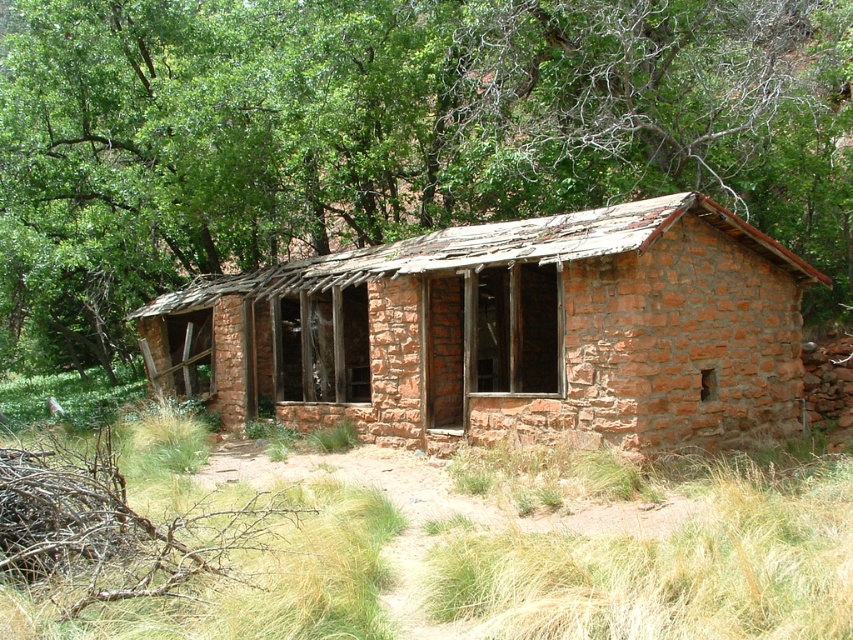
Question: Among these objects, which one is nearest to the camera?

Choices:
 (A) rustic stone hut at center
 (B) dry grass at center

Answer: (B)

Question: Can you confirm if green leafy tree at upper center is positioned above dry grass at center?

Choices:
 (A) yes
 (B) no

Answer: (A)

Question: Which of these objects is positioned closest to the rustic stone hut at center?

Choices:
 (A) dry grass at center
 (B) green leafy tree at upper center

Answer: (A)

Question: Where is green leafy tree at upper center located in relation to dry grass at center in the image?

Choices:
 (A) right
 (B) left

Answer: (B)

Question: Observing the image, what is the correct spatial positioning of green leafy tree at upper center in reference to rustic stone hut at center?

Choices:
 (A) right
 (B) left

Answer: (B)

Question: Among these objects, which one is farthest from the camera?

Choices:
 (A) green leafy tree at upper center
 (B) rustic stone hut at center

Answer: (A)